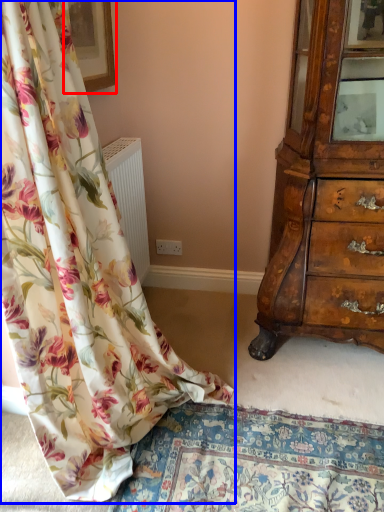
Question: Which point is further to the camera, picture frame (highlighted by a red box) or curtain (highlighted by a blue box)?

Choices:
 (A) picture frame
 (B) curtain

Answer: (A)